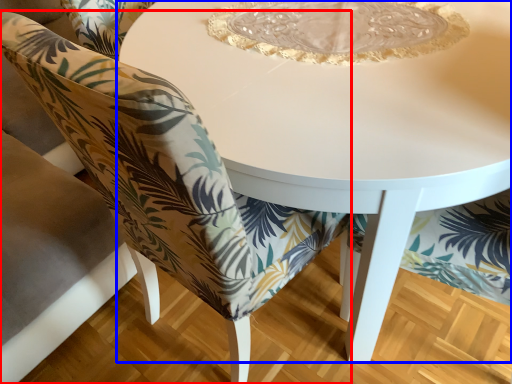
Question: Which point is closer to the camera, chair (highlighted by a red box) or table (highlighted by a blue box)?

Choices:
 (A) chair
 (B) table

Answer: (B)